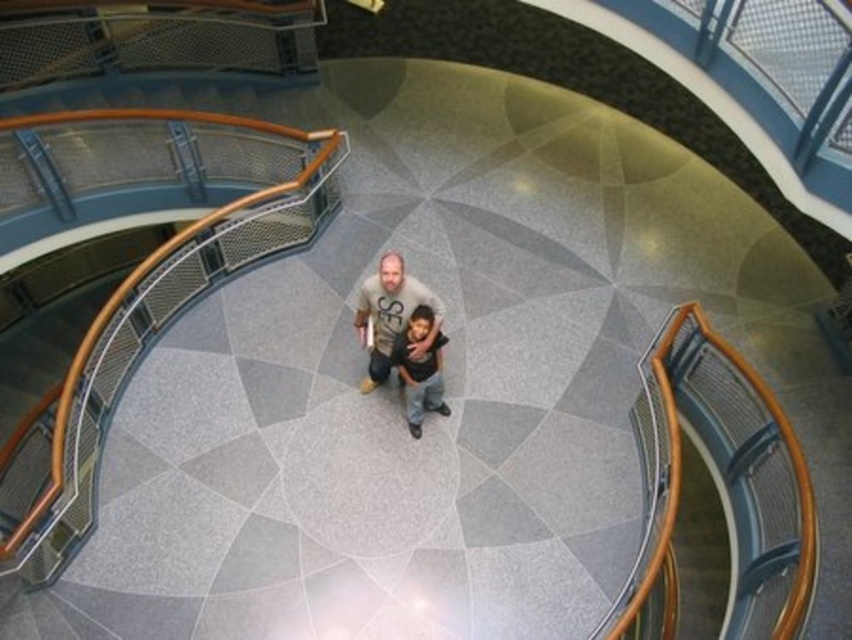
Who is lower down, light beige t-shirt at center or dark gray jeans at center?

dark gray jeans at center is below.

I want to click on light beige t-shirt at center, so (x=390, y=316).

I want to click on light beige t-shirt at center, so click(x=390, y=316).